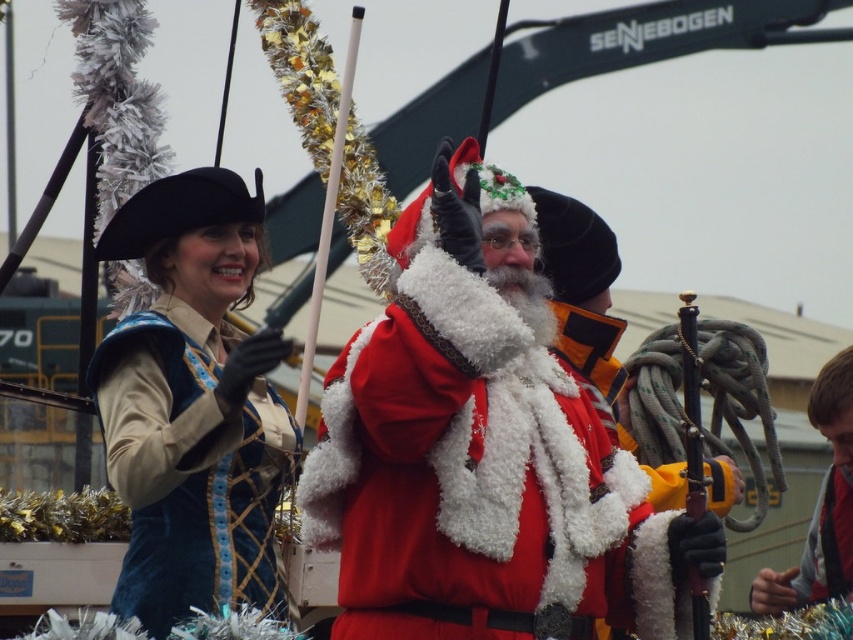
You are taking a photo of the two points in the image. Which point, point (483, 208) or point (840, 531), will appear larger in your photo?

Point (483, 208) will appear larger in the photo because it is closer to the camera than point (840, 531).

You are organizing a photo shoot and need to place both the fuzzy red santa at center and the red fabric jacket at lower right in a narrow hallway. Based on their sizes, which one should you place closer to the entrance to ensure they both fit in the frame?

The fuzzy red santa at center might be wider than red fabric jacket at lower right, so placing the fuzzy red santa at center closer to the entrance would allow both to fit in the narrow hallway by utilizing the available space more effectively.